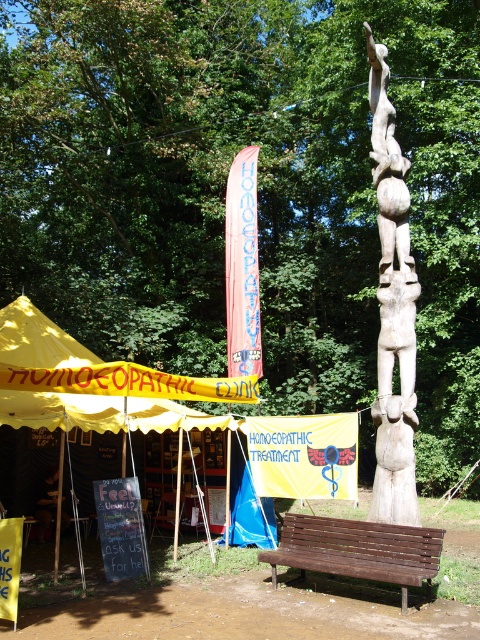
You are a visitor at the fair and want to sit down to rest. You see the brown wooden bench at lower center and the dark brown wooden sign at lower left. Which one can you sit on?

The brown wooden bench at lower center can be sat on, while the dark brown wooden sign at lower left is likely for display purposes and not meant for sitting.

You are at a fair and want to find the homeopathic clinic booth. You see a yellow fabric tent at lower left and a wooden statue at center. Which one is on the left side?

The yellow fabric tent at lower left is positioned on the left side of wooden statue at center, so the yellow fabric tent at lower left is on the left side.